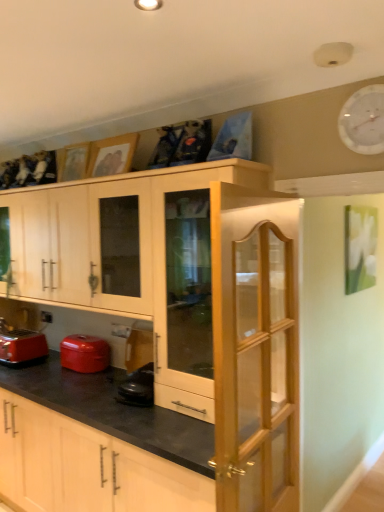
Question: From a real-world perspective, is matte red pot at lower left on light wood/glass cabinet door at center?

Choices:
 (A) yes
 (B) no

Answer: (B)

Question: Is matte red pot at lower left oriented away from light wood/glass cabinet door at center?

Choices:
 (A) no
 (B) yes

Answer: (A)

Question: Can light wood/glass cabinet door at center be found inside matte red pot at lower left?

Choices:
 (A) yes
 (B) no

Answer: (B)

Question: Does matte red pot at lower left appear on the left side of light wood/glass cabinet door at center?

Choices:
 (A) yes
 (B) no

Answer: (A)

Question: Does matte red pot at lower left lie in front of light wood/glass cabinet door at center?

Choices:
 (A) yes
 (B) no

Answer: (B)

Question: Based on their sizes in the image, would you say matte red pot at lower left is bigger or smaller than wooden picture frame at upper center, positioned as the first picture frame in right-to-left order?

Choices:
 (A) big
 (B) small

Answer: (A)

Question: In terms of height, does matte red pot at lower left look taller or shorter compared to wooden picture frame at upper center, positioned as the first picture frame in right-to-left order?

Choices:
 (A) short
 (B) tall

Answer: (A)

Question: Relative to wooden picture frame at upper center, the first picture frame from the front, is matte red pot at lower left in front or behind?

Choices:
 (A) behind
 (B) front

Answer: (A)

Question: From a real-world perspective, is matte red pot at lower left positioned above or below wooden picture frame at upper center, the first picture frame from the front?

Choices:
 (A) below
 (B) above

Answer: (A)

Question: Which is correct: wooden picture frame at upper center, the second picture frame in the left-to-right sequence, is inside matte wood cabinet at lower center, or outside of it?

Choices:
 (A) outside
 (B) inside

Answer: (A)

Question: Would you say wooden picture frame at upper center, positioned as the first picture frame in right-to-left order, is to the left or to the right of matte wood cabinet at lower center in the picture?

Choices:
 (A) right
 (B) left

Answer: (A)

Question: Considering the positions of wooden picture frame at upper center, which appears as the second picture frame when viewed from the back, and matte wood cabinet at lower center in the image, is wooden picture frame at upper center, which appears as the second picture frame when viewed from the back, wider or thinner than matte wood cabinet at lower center?

Choices:
 (A) wide
 (B) thin

Answer: (B)

Question: Is wooden picture frame at upper center, the first picture frame from the front, taller or shorter than matte wood cabinet at lower center?

Choices:
 (A) tall
 (B) short

Answer: (B)

Question: From a real-world perspective, is light wood/glass cabinet door at center positioned above or below wooden picture frame at upper left, the 2th picture frame when ordered from front to back?

Choices:
 (A) above
 (B) below

Answer: (B)

Question: From the image's perspective, relative to wooden picture frame at upper left, marked as the first picture frame in a left-to-right arrangement, is light wood/glass cabinet door at center above or below?

Choices:
 (A) above
 (B) below

Answer: (B)